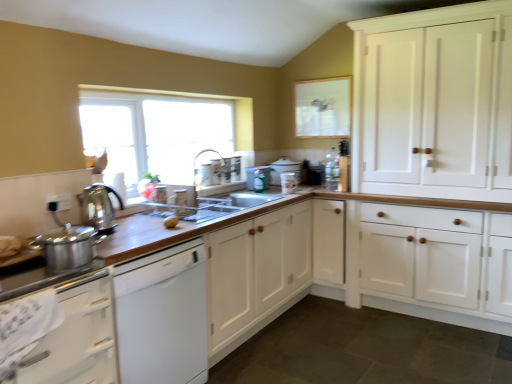
Where is `free point behind yellow matte potato at center`? The width and height of the screenshot is (512, 384). free point behind yellow matte potato at center is located at coordinates (175, 215).